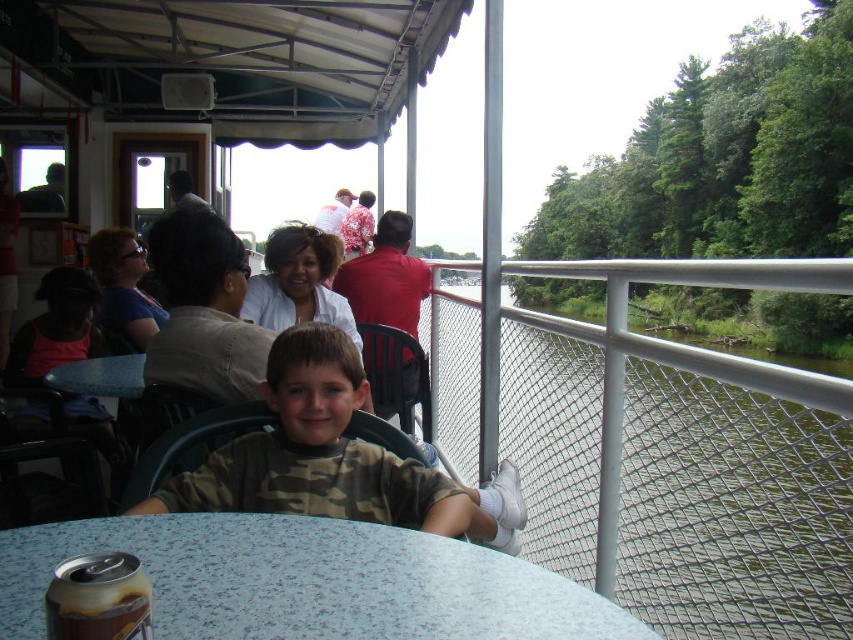
Question: Which of the following is the farthest from the observer?

Choices:
 (A) (306, 630)
 (B) (469, 509)
 (C) (77, 612)
 (D) (132, 372)

Answer: (D)

Question: Among these objects, which one is nearest to the camera?

Choices:
 (A) blue fabric table at lower center
 (B) camouflage fabric shirt at center

Answer: (B)

Question: Where is metallic silver soda can at lower left located in relation to blue fabric table at lower center in the image?

Choices:
 (A) below
 (B) above

Answer: (B)

Question: Is speckled plastic table at lower center bigger than metallic silver soda can at lower left?

Choices:
 (A) yes
 (B) no

Answer: (A)

Question: Which point is farther to the camera?

Choices:
 (A) (131, 381)
 (B) (231, 602)

Answer: (A)

Question: From the image, what is the correct spatial relationship of camouflage fabric shirt at center in relation to blue fabric table at lower center?

Choices:
 (A) right
 (B) left

Answer: (A)